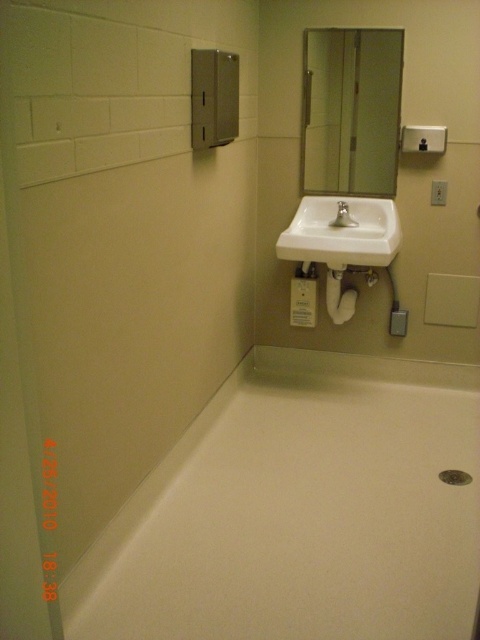
You are standing in the bathroom and want to place a new decorative plant on the floor near the white smooth bathtub at lower center. According to the coordinates provided, where should you place the plant relative to the bathtub?

The white smooth bathtub at lower center is located at coordinates point [300,509], so you should place the decorative plant near that point on the floor.

You are standing in the bathroom and want to reach both points. Which point, point (208, 588) or point (371, 252), is closer to you?

Point (208, 588) is closer to the viewer than point (371, 252).

You are trying to install a new faucet in the bathroom. The current matte silver faucet at center is blocking the access to the pipes under the white ceramic sink at center. Can you move the faucet to the right to gain access?

The white ceramic sink at center is to the left of the matte silver faucet at center, so moving the faucet to the right would not help since the sink itself is already positioned to the left of the faucet. Access to the pipes under the sink may require moving the sink instead.